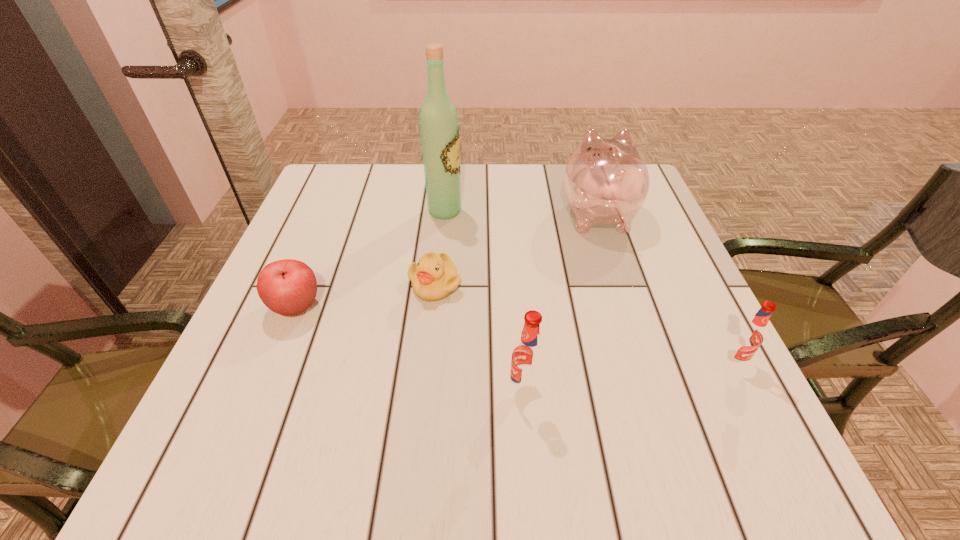
The width and height of the screenshot is (960, 540). In order to click on vacant space that's between the duckling and the tallest object in this screenshot , I will do `click(440, 247)`.

Locate an element on the screen. The width and height of the screenshot is (960, 540). empty space between the right root beer and the tallest object is located at coordinates (589, 286).

The image size is (960, 540). In order to click on vacant space that is in between the shortest object and the apple in this screenshot , I will do `click(366, 295)`.

Identify the location of vacant point located between the fifth object from left to right and the left root beer. (561, 301).

What are the coordinates of `vacant space that's between the leftmost object and the shorter root beer` in the screenshot? It's located at (515, 334).

At what (x,y) coordinates should I click in order to perform the action: click on free space between the apple and the shortest object. Please return your answer as a coordinate pair (x, y). This screenshot has width=960, height=540. Looking at the image, I should click on (366, 295).

Identify the location of free spot between the taller root beer and the rightmost object. The height and width of the screenshot is (540, 960). (629, 375).

Locate an element on the screen. Image resolution: width=960 pixels, height=540 pixels. vacant area that lies between the shorter root beer and the duckling is located at coordinates (584, 322).

I want to click on free space between the tallest object and the fifth object from left to right, so click(x=521, y=212).

You are a GUI agent. You are given a task and a screenshot of the screen. Output one action in this format:
    pyautogui.click(x=<x>, y=<y>)
    Task: Click on the fifth closest object to the farther root beer
    Image resolution: width=960 pixels, height=540 pixels.
    Given the screenshot: What is the action you would take?
    pyautogui.click(x=288, y=287)